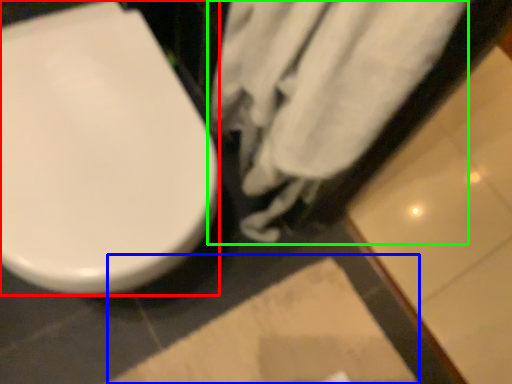
Question: Based on their relative distances, which object is nearer to toilet (highlighted by a red box)? Choose from square (highlighted by a blue box) and bath towel (highlighted by a green box).

Choices:
 (A) square
 (B) bath towel

Answer: (B)